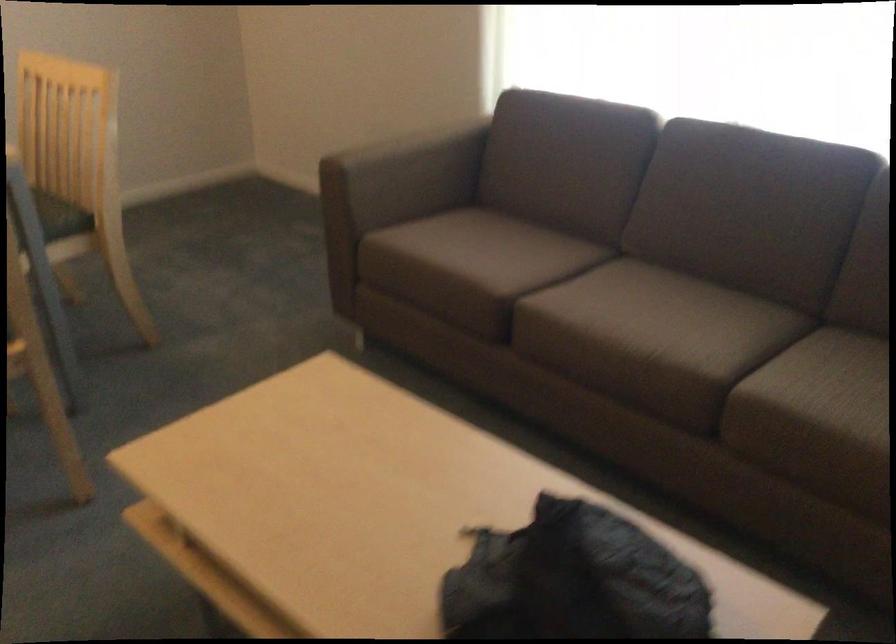
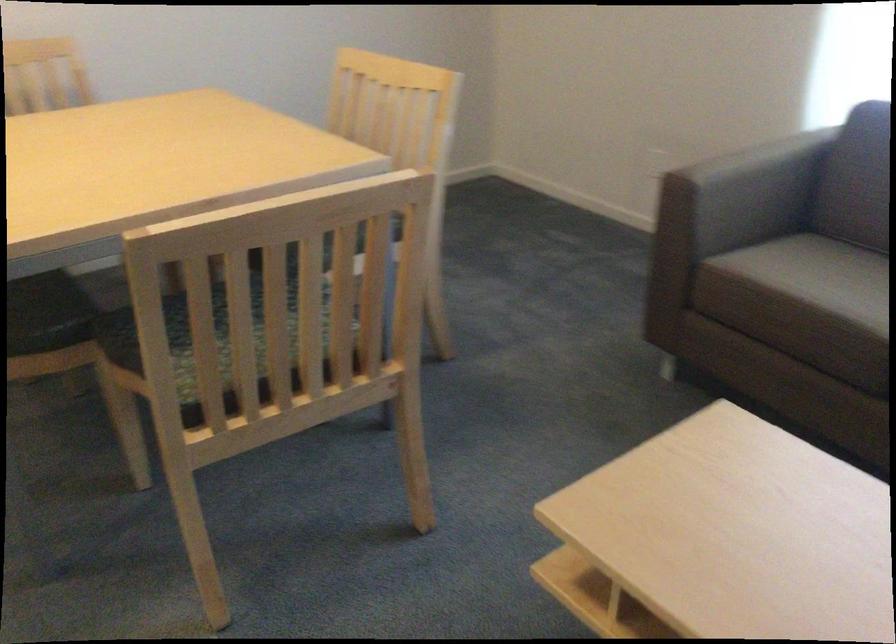
Where in the second image is the point corresponding to (x=409, y=171) from the first image?

(746, 192)